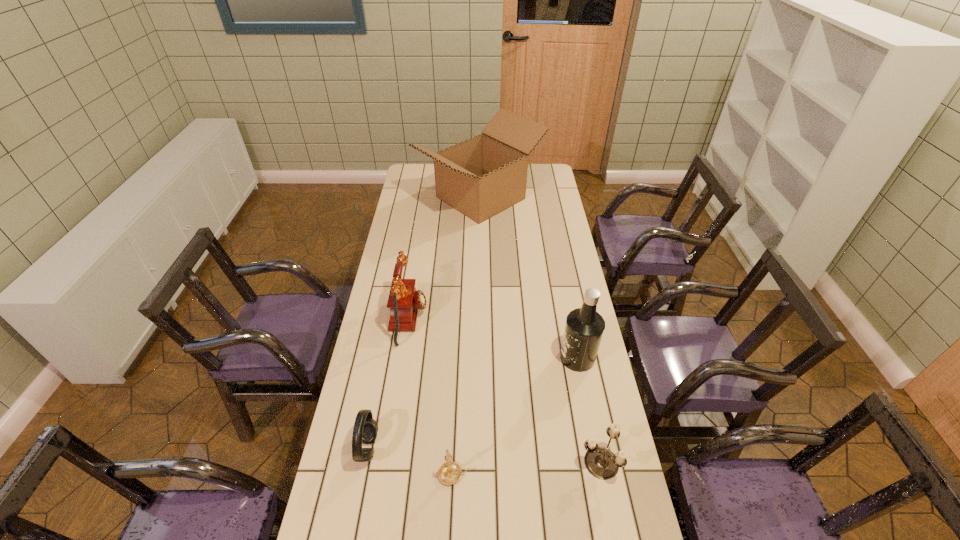
Locate an element on the screen. box is located at coordinates (x=480, y=177).

This screenshot has height=540, width=960. I want to click on liquor, so click(x=584, y=328).

Locate an element on the screen. This screenshot has width=960, height=540. the fourth shortest object is located at coordinates (404, 301).

At what (x,y) coordinates should I click in order to perform the action: click on the left candle holder. Please return your answer as a coordinate pair (x, y). Image resolution: width=960 pixels, height=540 pixels. Looking at the image, I should click on (449, 473).

You are a GUI agent. You are given a task and a screenshot of the screen. Output one action in this format:
    pyautogui.click(x=<x>, y=<y>)
    Task: Click on the right candle holder
    The width and height of the screenshot is (960, 540).
    Given the screenshot: What is the action you would take?
    pyautogui.click(x=602, y=463)

Identify the location of headset. Image resolution: width=960 pixels, height=540 pixels. (365, 429).

You are a GUI agent. You are given a task and a screenshot of the screen. Output one action in this format:
    pyautogui.click(x=<x>, y=<y>)
    Task: Click on the vacant space located on the front of the box
    This screenshot has height=540, width=960.
    Given the screenshot: What is the action you would take?
    pyautogui.click(x=481, y=247)

Locate an element on the screen. This screenshot has width=960, height=540. vacant space positioned 0.120m on the front label of the liquor is located at coordinates (524, 358).

Where is `free space located 0.230m on the front label of the liquor`? This screenshot has width=960, height=540. free space located 0.230m on the front label of the liquor is located at coordinates (492, 358).

Locate an element on the screen. The image size is (960, 540). free space located on the front label of the liquor is located at coordinates (447, 358).